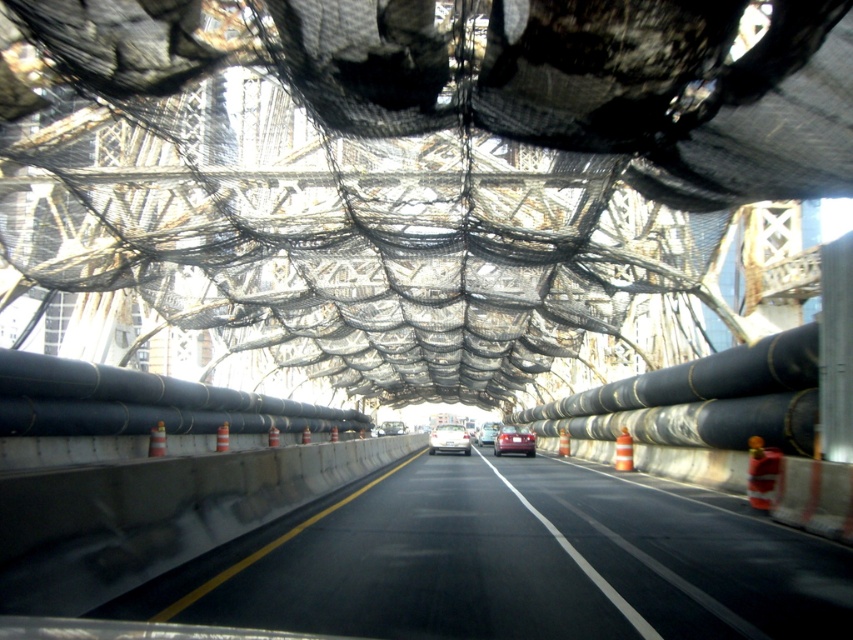
Question: Which point appears closest to the camera in this image?

Choices:
 (A) coord(485,440)
 (B) coord(581,564)

Answer: (B)

Question: Is white glossy sedan at center positioned in front of shiny red car at center?

Choices:
 (A) yes
 (B) no

Answer: (A)

Question: Which of the following is the farthest from the observer?

Choices:
 (A) (476, 435)
 (B) (399, 433)
 (C) (740, 612)

Answer: (A)

Question: Which is nearer to the matte black car at center?

Choices:
 (A) shiny red car at center
 (B) black asphalt highway at center

Answer: (A)

Question: Is matte black car at center above shiny silver sedan at center?

Choices:
 (A) no
 (B) yes

Answer: (B)

Question: Considering the relative positions of white glossy sedan at center and orange striped traffic cone at center in the image provided, where is white glossy sedan at center located with respect to orange striped traffic cone at center?

Choices:
 (A) right
 (B) left

Answer: (B)